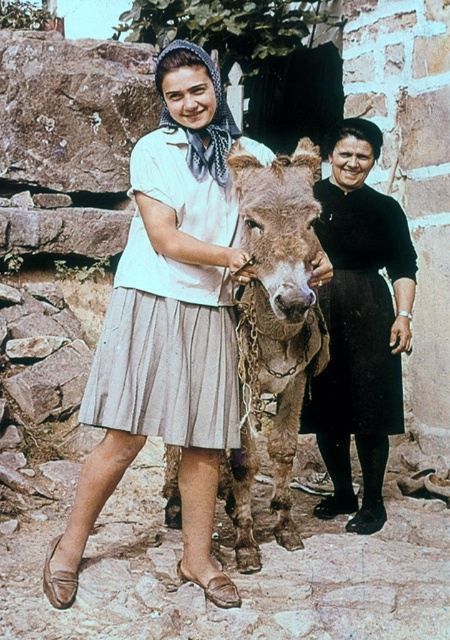
Can you confirm if white cotton shirt at center is positioned below light beige pleated skirt at center?

Yes, white cotton shirt at center is below light beige pleated skirt at center.

Can you confirm if white cotton shirt at center is positioned above light beige pleated skirt at center?

No, white cotton shirt at center is not above light beige pleated skirt at center.

Who is more forward, (x=190, y=68) or (x=215, y=282)?

Point (x=190, y=68) is more forward.

The width and height of the screenshot is (450, 640). What are the coordinates of `white cotton shirt at center` in the screenshot? It's located at (167, 324).

Between point (225, 378) and point (256, 182), which one is positioned in front?

Point (256, 182) is more forward.

Describe the element at coordinates (167, 324) in the screenshot. I see `white cotton shirt at center` at that location.

Identify the location of white cotton shirt at center. (167, 324).

Does light beige pleated skirt at center have a lesser width compared to brown rough textured mule at center?

Incorrect, light beige pleated skirt at center's width is not less than brown rough textured mule at center's.

Who is higher up, light beige pleated skirt at center or brown rough textured mule at center?

light beige pleated skirt at center is higher up.

Does point (175, 154) lie behind point (253, 211)?

Yes, point (175, 154) is behind point (253, 211).

This screenshot has height=640, width=450. Find the location of `light beige pleated skirt at center`. light beige pleated skirt at center is located at coordinates (166, 352).